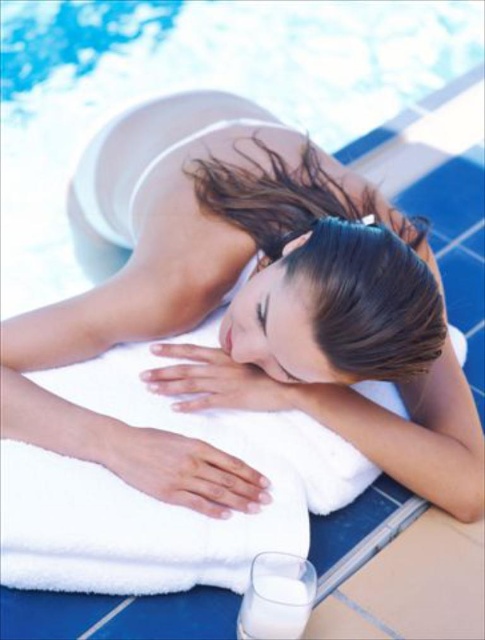
Question: Does white soft towel at upper center appear over white opaque glass at lower center?

Choices:
 (A) no
 (B) yes

Answer: (B)

Question: Which point is closer to the camera taking this photo?

Choices:
 (A) (244, 598)
 (B) (233, 401)

Answer: (A)

Question: Can you confirm if white soft towel at upper center is positioned to the right of white opaque glass at lower center?

Choices:
 (A) yes
 (B) no

Answer: (A)

Question: Does white soft towel at upper center lie behind white opaque glass at lower center?

Choices:
 (A) no
 (B) yes

Answer: (A)

Question: Which of the following is the farthest from the observer?

Choices:
 (A) (378, 304)
 (B) (259, 570)

Answer: (B)